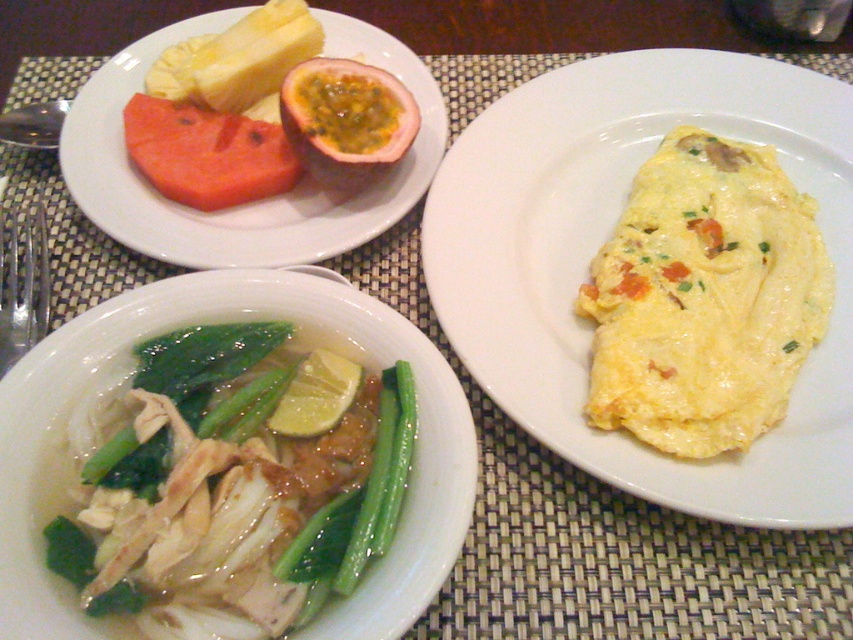
Based on the photo, you are a nutritionist analyzing the meal layout. Which object is smaller in size between the green leafy vegetables at lower left and the matte red watermelon at upper left?

The green leafy vegetables at lower left are smaller in size compared to the matte red watermelon at upper left according to the description.

You are a chef arranging a meal on a woven placemat. You have a plate on the left with fruits and a plate on the right with an omelette. Where should you place the green leafy vegetables at lower left to ensure they are positioned correctly according to the image?

The green leafy vegetables at lower left should be placed at point (238, 484) to match their position in the image.